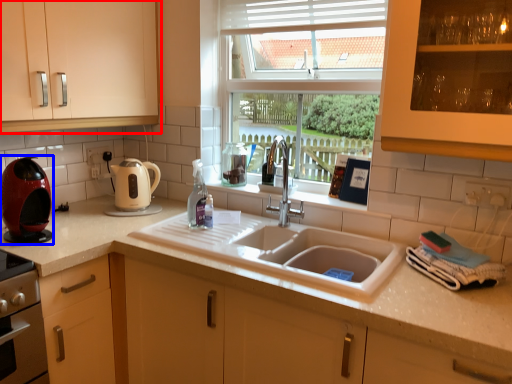
Question: Which object appears farthest to the camera in this image, cabinetry (highlighted by a red box) or kitchen appliance (highlighted by a blue box)?

Choices:
 (A) cabinetry
 (B) kitchen appliance

Answer: (B)